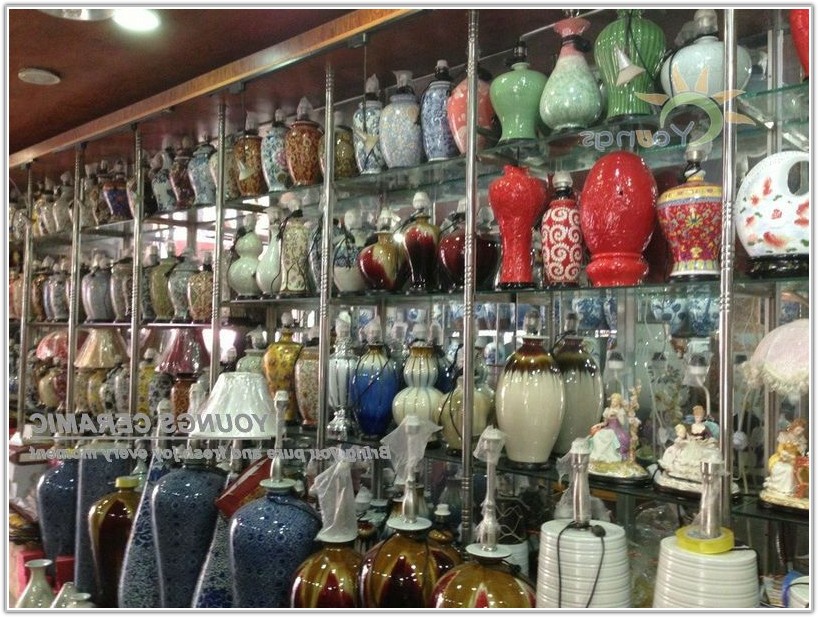
You are a GUI agent. You are given a task and a screenshot of the screen. Output one action in this format:
    pyautogui.click(x=<x>, y=<y>)
    Task: Click on the blue urns
    
    Given the screenshot: What is the action you would take?
    coord(362,408), coord(281,507), coord(182,513), coord(145,571), coord(56,495)